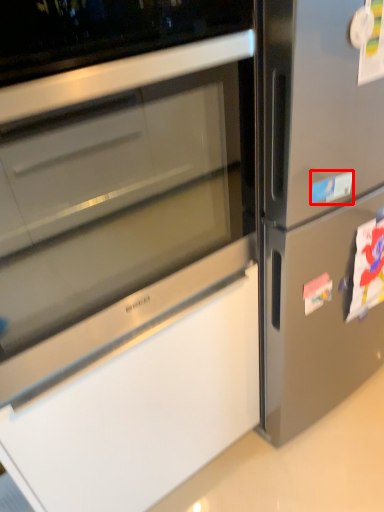
Question: Considering the relative positions of sticker (annotated by the red box) and sticker in the image provided, where is sticker (annotated by the red box) located with respect to the staircase?

Choices:
 (A) left
 (B) right

Answer: (A)